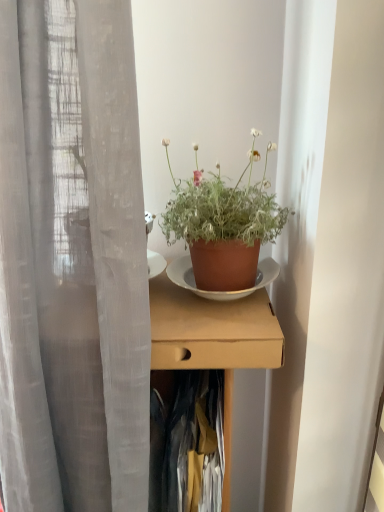
Identify the location of dark blue fabric at center. This screenshot has height=512, width=384. (188, 443).

The width and height of the screenshot is (384, 512). Describe the element at coordinates (213, 339) in the screenshot. I see `brown cardboard box at center` at that location.

Where is `dark blue fabric at center`? Image resolution: width=384 pixels, height=512 pixels. dark blue fabric at center is located at coordinates (188, 443).

This screenshot has width=384, height=512. In order to click on desk that appears on the left of terracotta pot at center in this screenshot , I will do `click(213, 339)`.

Is terracotta pot at center oriented towards brown cardboard box at center?

No, terracotta pot at center is not turned towards brown cardboard box at center.

Is terracotta pot at center to the left of brown cardboard box at center from the viewer's perspective?

No.

From the picture: From the image's perspective, is terracotta pot at center over brown cardboard box at center?

Yes, from the image's perspective, terracotta pot at center is on top of brown cardboard box at center.

Consider the image. From a real-world perspective, which object stands above the other?

From a 3D spatial view, terracotta pot at center is above.

What's the angular difference between brown cardboard box at center and terracotta pot at center's facing directions?

The angular difference between brown cardboard box at center and terracotta pot at center is 0.000247 degrees.

Between brown cardboard box at center and terracotta pot at center, which one has smaller width?

terracotta pot at center is thinner.

I want to click on houseplant that is above the brown cardboard box at center (from a real-world perspective), so click(223, 225).

The image size is (384, 512). Find the location of `desk that appears on the right of dark blue fabric at center`. desk that appears on the right of dark blue fabric at center is located at coordinates (213, 339).

From a real-world perspective, is dark blue fabric at center physically located above or below brown cardboard box at center?

dark blue fabric at center is below brown cardboard box at center.

Which object is thinner, dark blue fabric at center or brown cardboard box at center?

dark blue fabric at center is thinner.

Would you say dark blue fabric at center is outside brown cardboard box at center?

No, dark blue fabric at center is not entirely external to brown cardboard box at center.

From a real-world perspective, is brown cardboard box at center positioned under dark blue fabric at center based on gravity?

No, from a real-world perspective, brown cardboard box at center is not beneath dark blue fabric at center.

Considering their positions, is brown cardboard box at center located in front of or behind dark blue fabric at center?

brown cardboard box at center is in front of dark blue fabric at center.

How different are the orientations of brown cardboard box at center and dark blue fabric at center in degrees?

3.4 degrees.

Identify the location of desk above the dark blue fabric at center (from the image's perspective). Image resolution: width=384 pixels, height=512 pixels. click(213, 339).

Which object is wider, terracotta pot at center or dark blue fabric at center?

dark blue fabric at center.

Considering the sizes of objects terracotta pot at center and dark blue fabric at center in the image provided, who is shorter, terracotta pot at center or dark blue fabric at center?

Standing shorter between the two is terracotta pot at center.

From a real-world perspective, between terracotta pot at center and dark blue fabric at center, who is vertically higher?

terracotta pot at center, from a real-world perspective.

Considering the sizes of terracotta pot at center and dark blue fabric at center in the image, is terracotta pot at center bigger or smaller than dark blue fabric at center?

Clearly, terracotta pot at center is smaller in size than dark blue fabric at center.

At what (x,y) coordinates should I click in order to perform the action: click on houseplant above the dark blue fabric at center (from the image's perspective). Please return your answer as a coordinate pair (x, y). Image resolution: width=384 pixels, height=512 pixels. Looking at the image, I should click on (223, 225).

Which of these two, dark blue fabric at center or terracotta pot at center, is thinner?

With smaller width is terracotta pot at center.

Is dark blue fabric at center next to terracotta pot at center?

No, dark blue fabric at center is not making contact with terracotta pot at center.

What are the coordinates of `houseplant that is on the right side of brown cardboard box at center` in the screenshot? It's located at (223, 225).

There is a brown cardboard box at center. What are the coordinates of `houseplant above it (from a real-world perspective)` in the screenshot? It's located at (223, 225).

Looking at the image, which one is located further to terracotta pot at center, dark blue fabric at center or brown cardboard box at center?

dark blue fabric at center is further to terracotta pot at center.

Looking at the image, which one is located further to dark blue fabric at center, terracotta pot at center or brown cardboard box at center?

Based on the image, terracotta pot at center appears to be further to dark blue fabric at center.

From the picture: Which object lies nearer to the anchor point terracotta pot at center, brown cardboard box at center or dark blue fabric at center?

brown cardboard box at center is positioned closer to the anchor terracotta pot at center.

When comparing their distances from brown cardboard box at center, does dark blue fabric at center or terracotta pot at center seem closer?

dark blue fabric at center lies closer to brown cardboard box at center than the other object.

Looking at this image, estimate the real-world distances between objects in this image. Which object is further from brown cardboard box at center, terracotta pot at center or dark blue fabric at center?

terracotta pot at center lies further to brown cardboard box at center than the other object.

When comparing their distances from dark blue fabric at center, does brown cardboard box at center or terracotta pot at center seem closer?

brown cardboard box at center is closer to dark blue fabric at center.

Where is `desk between terracotta pot at center and dark blue fabric at center from top to bottom`? The width and height of the screenshot is (384, 512). desk between terracotta pot at center and dark blue fabric at center from top to bottom is located at coordinates (213, 339).